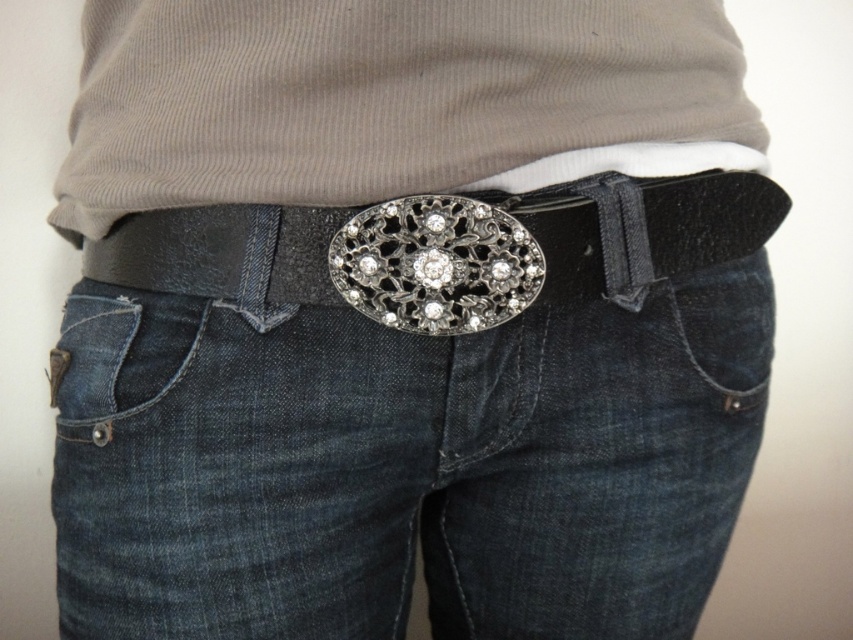
Question: Which object appears closest to the camera in this image?

Choices:
 (A) denim at lower left
 (B) metallic silver buckle at center

Answer: (B)

Question: Is metallic silver buckle at center positioned behind denim at lower left?

Choices:
 (A) no
 (B) yes

Answer: (A)

Question: Is metallic silver buckle at center to the right of denim at lower left from the viewer's perspective?

Choices:
 (A) yes
 (B) no

Answer: (A)

Question: Which object appears farthest from the camera in this image?

Choices:
 (A) metallic silver buckle at center
 (B) denim at lower left

Answer: (B)

Question: Can you confirm if metallic silver buckle at center is wider than denim at lower left?

Choices:
 (A) yes
 (B) no

Answer: (A)

Question: Among these points, which one is nearest to the camera?

Choices:
 (A) (677, 268)
 (B) (183, 355)

Answer: (B)